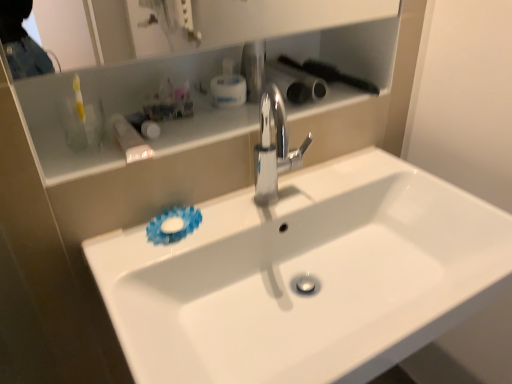
Question: Considering the positions of polished chrome faucet at center and white glossy sink at center in the image, is polished chrome faucet at center wider or thinner than white glossy sink at center?

Choices:
 (A) thin
 (B) wide

Answer: (A)

Question: Which is correct: polished chrome faucet at center is inside white glossy sink at center, or outside of it?

Choices:
 (A) outside
 (B) inside

Answer: (A)

Question: Based on their relative distances, which object is nearer to the white glossy sink at center?

Choices:
 (A) translucent plastic container at upper left
 (B) white glossy cabinet at upper center
 (C) polished chrome faucet at center

Answer: (C)

Question: Considering the real-world distances, which object is closest to the translucent plastic container at upper left?

Choices:
 (A) white glossy sink at center
 (B) polished chrome faucet at center
 (C) white glossy cabinet at upper center

Answer: (C)